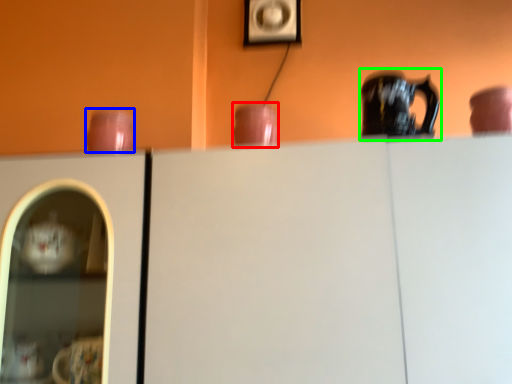
Question: Which object is the farthest from tableware (highlighted by a red box)? Choose among these: tableware (highlighted by a blue box) or jug (highlighted by a green box).

Choices:
 (A) tableware
 (B) jug

Answer: (A)